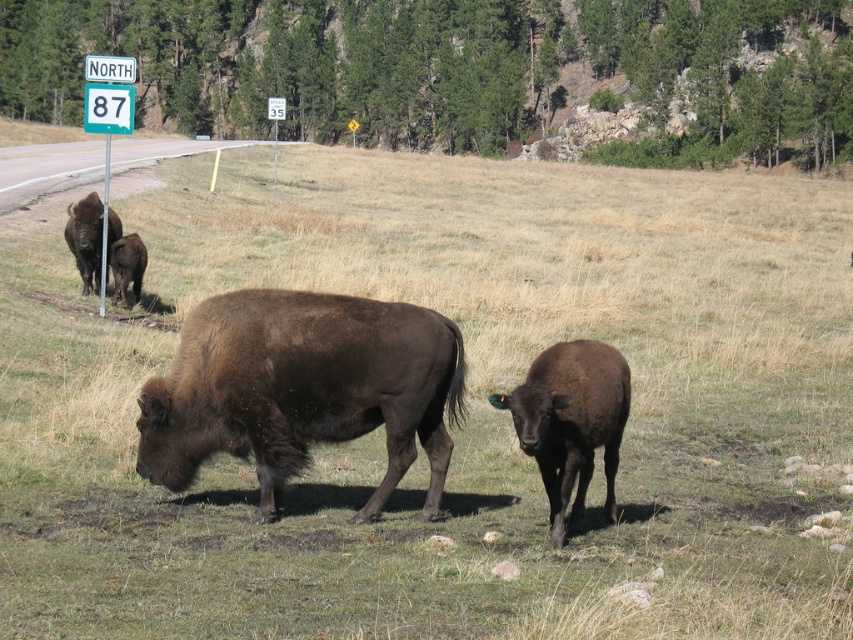
You are a wildlife photographer aiming to capture a photo of the brown matte buffalo at left and the dark brown fur at left. Given that your camera has a limited field of view, can you fit both subjects into a single frame without moving your position?

The brown matte buffalo at left is wider than the dark brown fur at left, so you can fit both into the frame since the buffalo is larger and likely encompasses the fur area.

You are a wildlife photographer aiming to capture a photo of the brown furry buffalo at center and the dark brown fur at left. Based on their sizes, which one should you focus on to ensure it appears larger in your photo?

The brown furry buffalo at center is taller than dark brown fur at left, so focusing on the brown furry buffalo at center will make it appear larger in the photo.